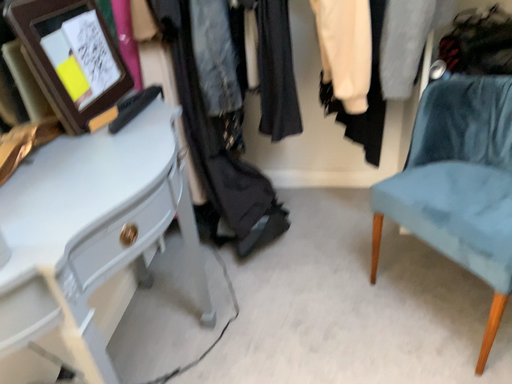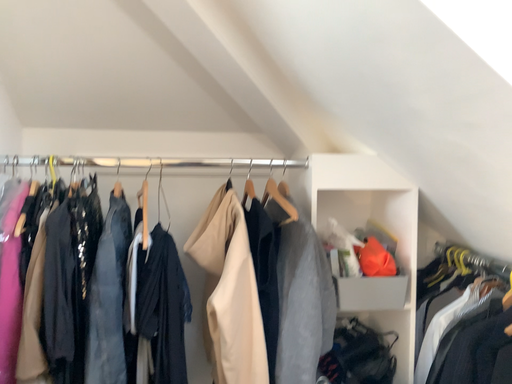
Question: Which way did the camera rotate in the video?

Choices:
 (A) rotated downward
 (B) rotated upward

Answer: (B)